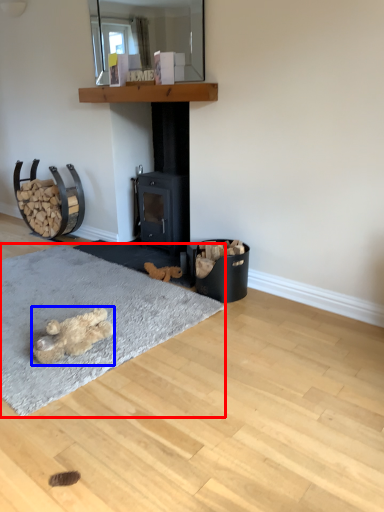
Question: Among these objects, which one is nearest to the camera, mat (highlighted by a red box) or animal (highlighted by a blue box)?

Choices:
 (A) mat
 (B) animal

Answer: (A)